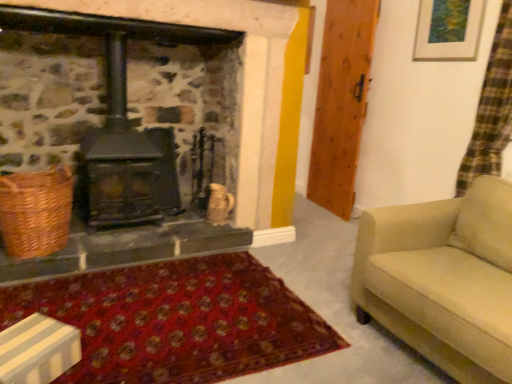
Question: Is the depth of wooden door at right greater than that of beige fabric couch at right?

Choices:
 (A) no
 (B) yes

Answer: (B)

Question: Is wooden door at right bigger than beige fabric couch at right?

Choices:
 (A) yes
 (B) no

Answer: (B)

Question: Is wooden door at right positioned before beige fabric couch at right?

Choices:
 (A) no
 (B) yes

Answer: (A)

Question: Is wooden door at right next to beige fabric couch at right?

Choices:
 (A) yes
 (B) no

Answer: (B)

Question: Does wooden door at right have a lesser height compared to beige fabric couch at right?

Choices:
 (A) no
 (B) yes

Answer: (A)

Question: Do you think black cast iron wood burning stove at center is within wooden door at right, or outside of it?

Choices:
 (A) outside
 (B) inside

Answer: (A)

Question: From their relative heights in the image, would you say black cast iron wood burning stove at center is taller or shorter than wooden door at right?

Choices:
 (A) short
 (B) tall

Answer: (A)

Question: Relative to wooden door at right, is black cast iron wood burning stove at center in front or behind?

Choices:
 (A) behind
 (B) front

Answer: (B)

Question: Would you say black cast iron wood burning stove at center is to the left or to the right of wooden door at right in the picture?

Choices:
 (A) right
 (B) left

Answer: (B)

Question: Is wooden door at right situated inside wooden picture frame at upper right or outside?

Choices:
 (A) outside
 (B) inside

Answer: (A)

Question: Considering their positions, is wooden door at right located in front of or behind wooden picture frame at upper right?

Choices:
 (A) behind
 (B) front

Answer: (A)

Question: From the image's perspective, is wooden door at right above or below wooden picture frame at upper right?

Choices:
 (A) below
 (B) above

Answer: (A)

Question: Looking at their shapes, would you say wooden door at right is wider or thinner than wooden picture frame at upper right?

Choices:
 (A) thin
 (B) wide

Answer: (B)

Question: Considering the positions of beige fabric couch at right and black cast iron wood burning stove at center in the image, is beige fabric couch at right wider or thinner than black cast iron wood burning stove at center?

Choices:
 (A) thin
 (B) wide

Answer: (B)

Question: Is beige fabric couch at right situated inside black cast iron wood burning stove at center or outside?

Choices:
 (A) inside
 (B) outside

Answer: (B)